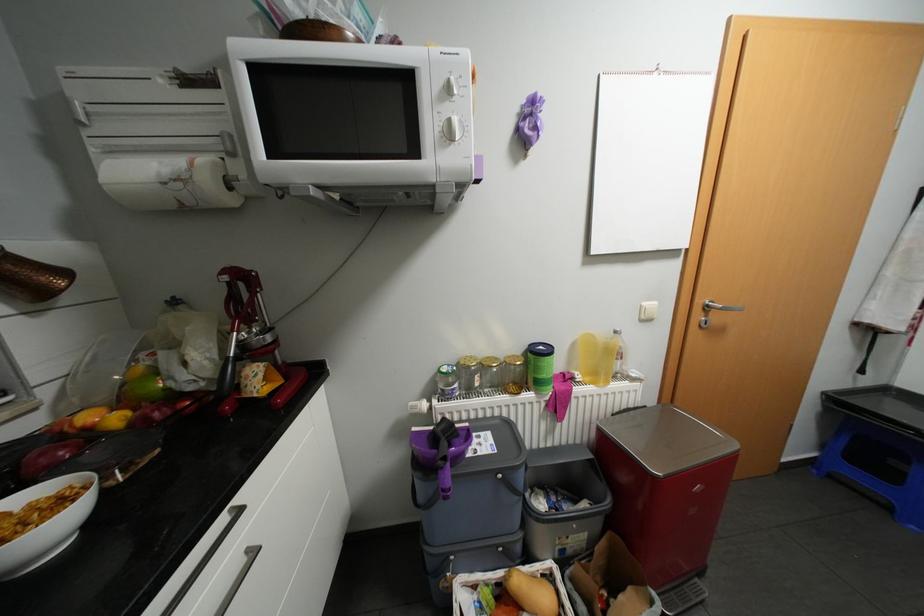
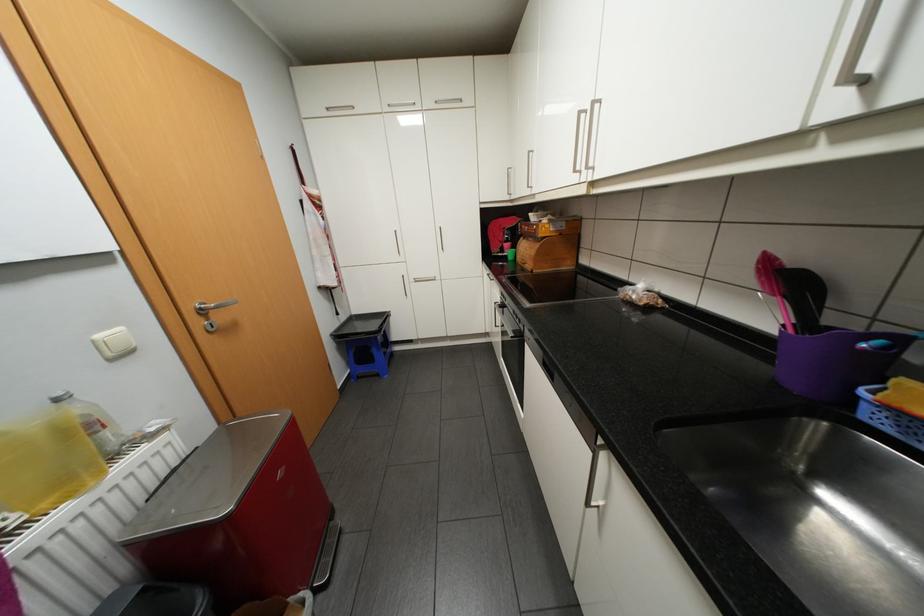
The point at (624,331) is marked in the first image. Where is the corresponding point in the second image?

(65, 399)